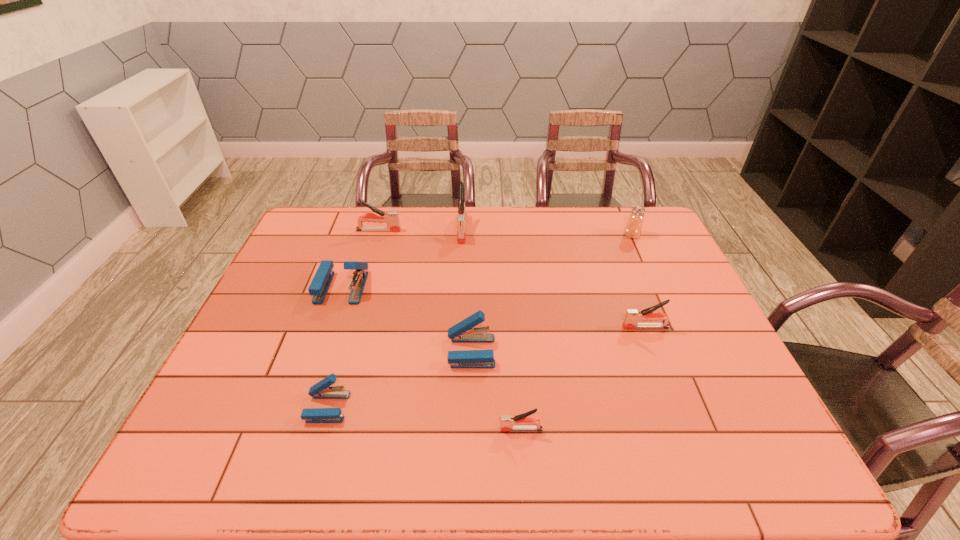
This screenshot has width=960, height=540. I want to click on vacant space situated on the handle side of the rightmost gray stapler, so click(533, 327).

The height and width of the screenshot is (540, 960). I want to click on vacant space located 0.220m on the right of the second biggest blue stapler, so click(582, 352).

Locate an element on the screen. Image resolution: width=960 pixels, height=540 pixels. free space located 0.320m on the handle side of the sixth object from left to right is located at coordinates (352, 429).

This screenshot has width=960, height=540. Identify the location of free space located on the handle side of the sixth object from left to right. (344, 429).

What are the coordinates of `vacant space positioned on the handle side of the sixth object from left to right` in the screenshot? It's located at (459, 429).

Where is `vacant space located on the back of the second nearest object`? Image resolution: width=960 pixels, height=540 pixels. vacant space located on the back of the second nearest object is located at coordinates (361, 292).

In order to click on saltshaker that is at the far edge in this screenshot , I will do `click(633, 228)`.

I want to click on object at the left edge, so click(320, 284).

Locate an element on the screen. Image resolution: width=960 pixels, height=540 pixels. saltshaker at the right edge is located at coordinates (633, 228).

The image size is (960, 540). What are the coordinates of `stapler present at the right edge` in the screenshot? It's located at (633, 316).